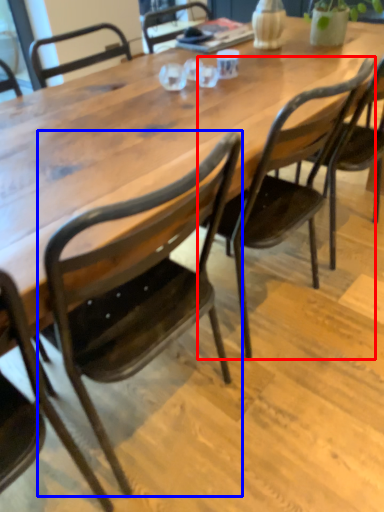
Question: Which object is closer to the camera taking this photo, chair (highlighted by a red box) or chair (highlighted by a blue box)?

Choices:
 (A) chair
 (B) chair

Answer: (B)